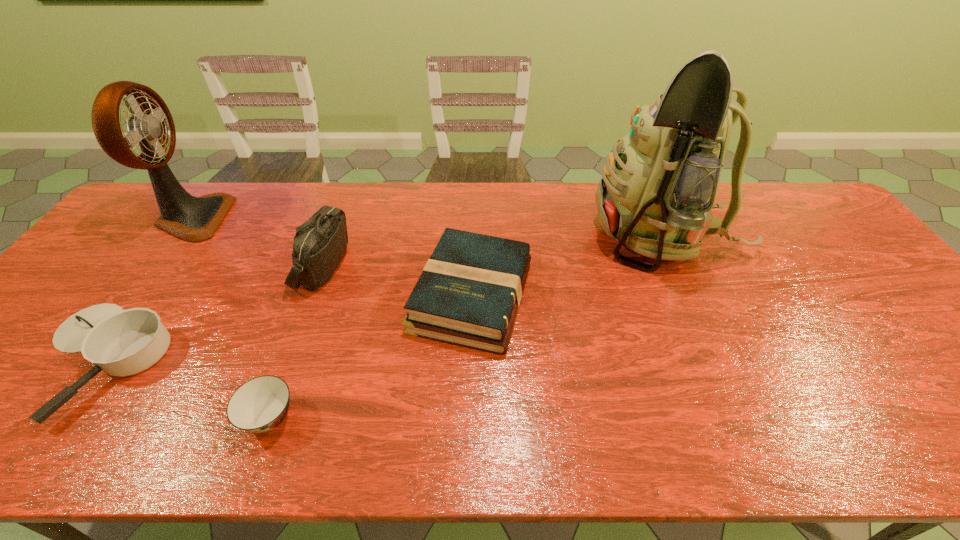
The height and width of the screenshot is (540, 960). What are the coordinates of `backpack` in the screenshot? It's located at (658, 187).

Find the location of a particular element. The height and width of the screenshot is (540, 960). the rightmost object is located at coordinates (658, 187).

Locate an element on the screen. The image size is (960, 540). the second tallest object is located at coordinates (194, 219).

At what (x,y) coordinates should I click in order to perform the action: click on the third tallest object. Please return your answer as a coordinate pair (x, y). This screenshot has width=960, height=540. Looking at the image, I should click on (320, 243).

Identify the location of the second object from right to left. This screenshot has width=960, height=540. (469, 292).

This screenshot has height=540, width=960. I want to click on hardback book, so click(469, 292).

The width and height of the screenshot is (960, 540). I want to click on soup bowl, so click(x=259, y=405).

Locate an element on the screen. The image size is (960, 540). vacant area situated on the front-facing side of the rightmost object is located at coordinates (482, 236).

Identify the location of vacant area situated 0.050m on the front-facing side of the rightmost object. The image size is (960, 540). (574, 236).

Locate an element on the screen. This screenshot has width=960, height=540. free location located on the front-facing side of the rightmost object is located at coordinates (466, 236).